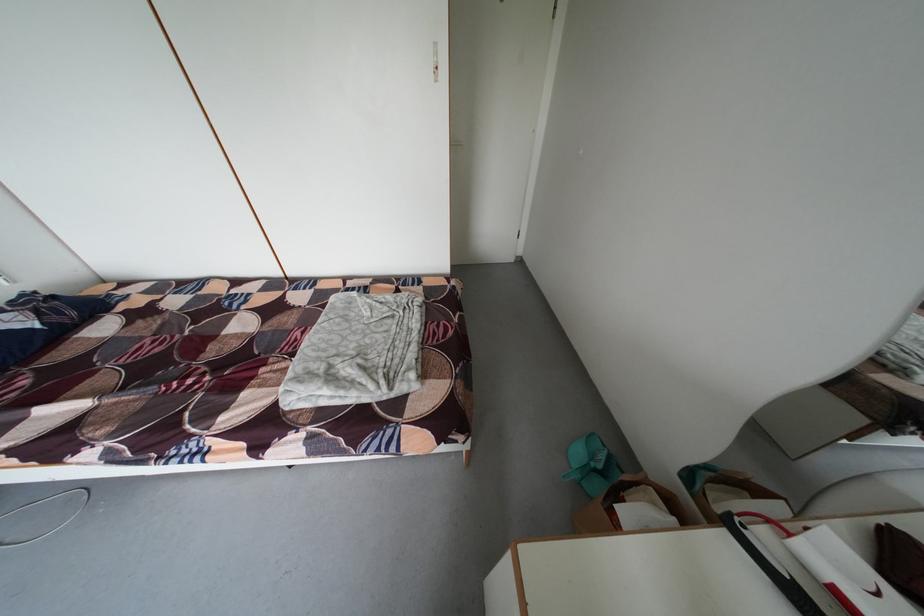
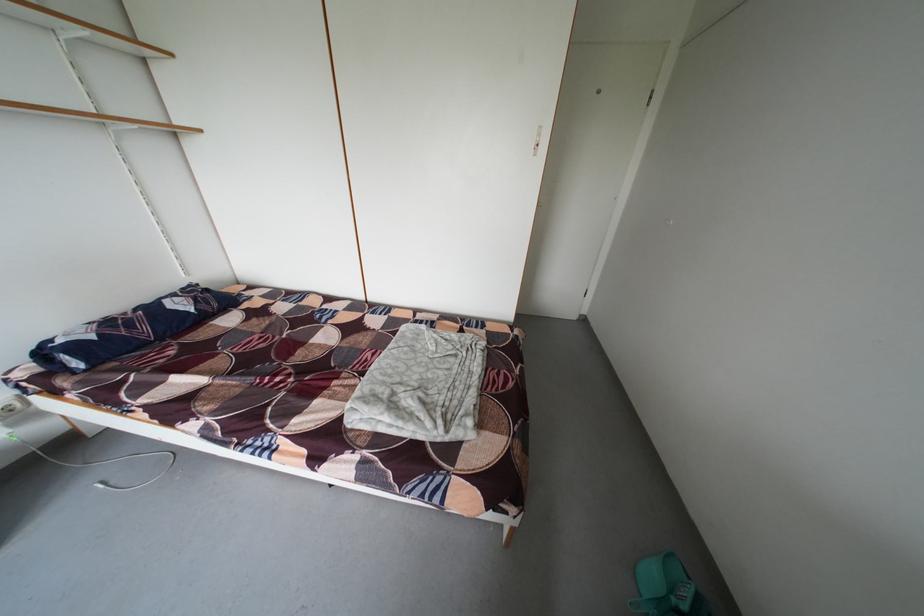
Question: Which direction would the cameraman need to move to produce the second image? Reply with the corresponding letter.

Choices:
 (A) Left
 (B) Right
 (C) Forward
 (D) Backward

Answer: (A)